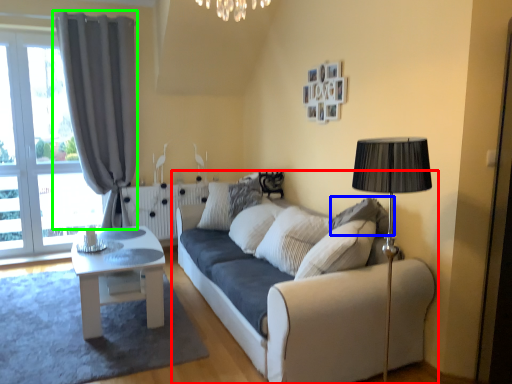
Question: Which object is positioned farthest from studio couch (highlighted by a red box)? Select from pillow (highlighted by a blue box) and curtain (highlighted by a green box).

Choices:
 (A) pillow
 (B) curtain

Answer: (B)